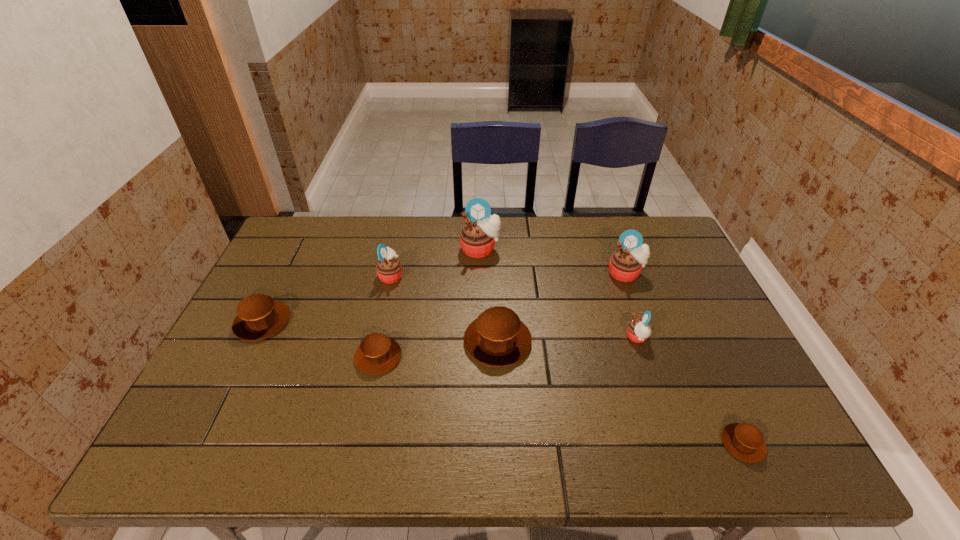
Find the location of a particular element. This screenshot has width=960, height=540. the seventh tallest object is located at coordinates (377, 353).

Locate an element on the screen. the rightmost muffin is located at coordinates (745, 441).

Find the location of a particular element. Image resolution: width=960 pixels, height=540 pixels. the rightmost brown muffin is located at coordinates (745, 441).

Locate an element on the screen. vacant area situated on the front-facing side of the second pink muffin from left to right is located at coordinates (481, 335).

The width and height of the screenshot is (960, 540). Identify the location of free space located 0.070m on the front-facing side of the third smallest pink muffin. (636, 301).

The width and height of the screenshot is (960, 540). I want to click on vacant area situated on the front-facing side of the third biggest pink muffin, so click(426, 275).

I want to click on free spot located on the right of the biggest brown muffin, so click(x=558, y=341).

Find the location of `free region located 0.150m on the front-facing side of the smallest pink muffin`. free region located 0.150m on the front-facing side of the smallest pink muffin is located at coordinates (569, 338).

Identify the location of free spot located 0.100m on the front-facing side of the smallest pink muffin. (588, 338).

Where is `vacant area situated 0.090m on the front-facing side of the smallest pink muffin`? The height and width of the screenshot is (540, 960). vacant area situated 0.090m on the front-facing side of the smallest pink muffin is located at coordinates (592, 338).